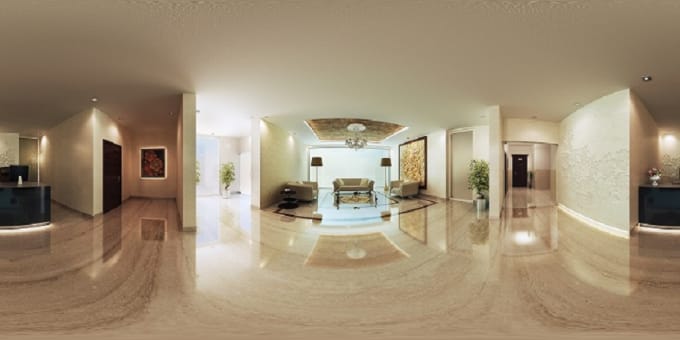
Locate an element on the screen. This screenshot has width=680, height=340. couch is located at coordinates (396, 186), (352, 179), (303, 190).